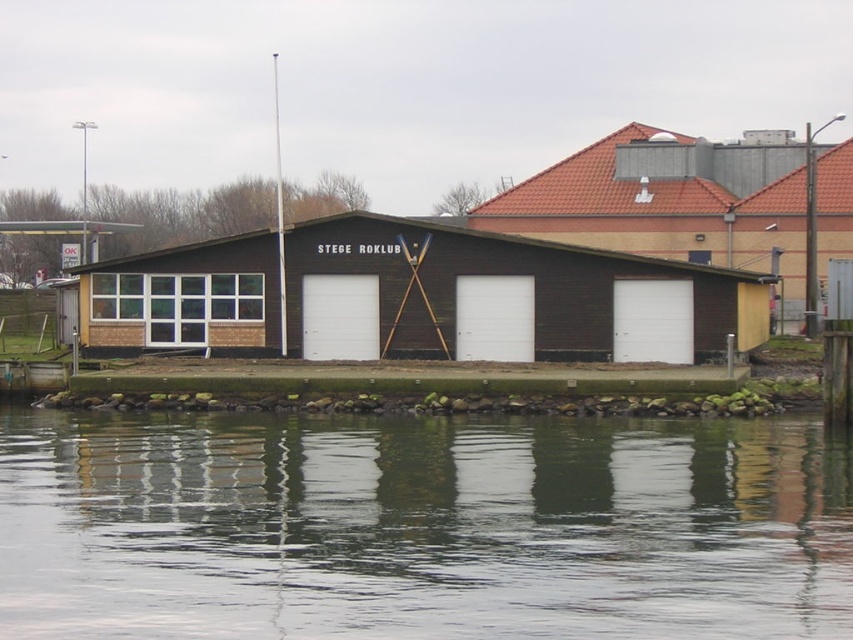
Which is in front, point (239, 584) or point (461, 285)?

Point (239, 584)

Based on the photo, does transparent water at lower center appear over brown wooden dock at center?

No, transparent water at lower center is not above brown wooden dock at center.

Locate an element on the screen. transparent water at lower center is located at coordinates (421, 525).

Locate an element on the screen. transparent water at lower center is located at coordinates (x=421, y=525).